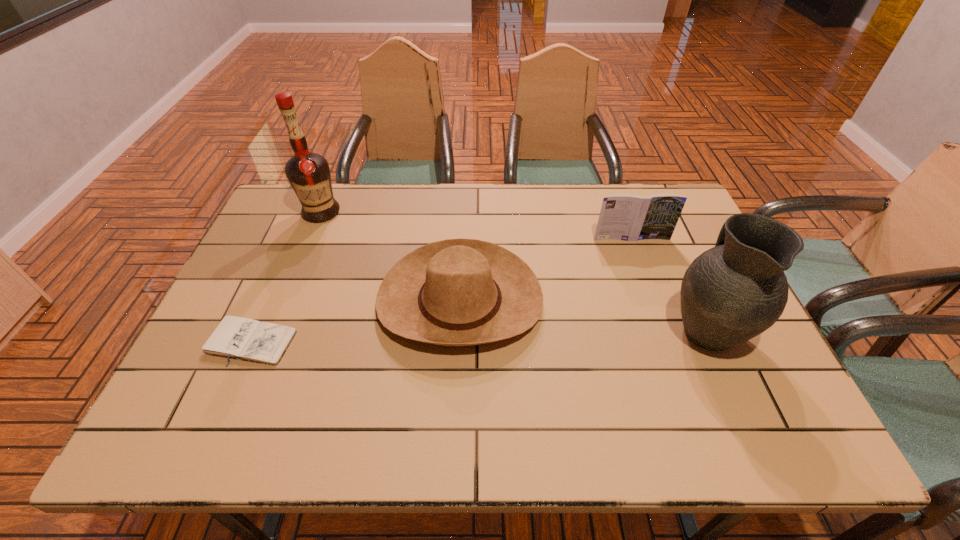
You are a GUI agent. You are given a task and a screenshot of the screen. Output one action in this format:
    pyautogui.click(x=<x>, y=<y>)
    Task: Click on the farthest object
    
    Given the screenshot: What is the action you would take?
    pyautogui.click(x=308, y=173)

The image size is (960, 540). In order to click on liquor in this screenshot , I will do `click(308, 173)`.

Identify the location of the second tallest object. (731, 293).

Locate an element on the screen. the fourth nearest object is located at coordinates (629, 217).

This screenshot has width=960, height=540. Find the location of `cowboy hat`. cowboy hat is located at coordinates (456, 292).

Locate an element on the screen. The image size is (960, 540). notebook is located at coordinates (235, 337).

At what (x,y) coordinates should I click in order to perform the action: click on vacant space located 0.110m on the front and back of the tallest object. Please return your answer as a coordinate pair (x, y). This screenshot has height=540, width=960. Looking at the image, I should click on (306, 248).

Locate an element on the screen. vacant space located on the side of the second tallest object with the handle is located at coordinates (656, 215).

Locate an element on the screen. vacant point located 0.200m on the side of the second tallest object with the handle is located at coordinates (669, 246).

Identify the location of vacant space located on the side of the second tallest object with the handle. (662, 231).